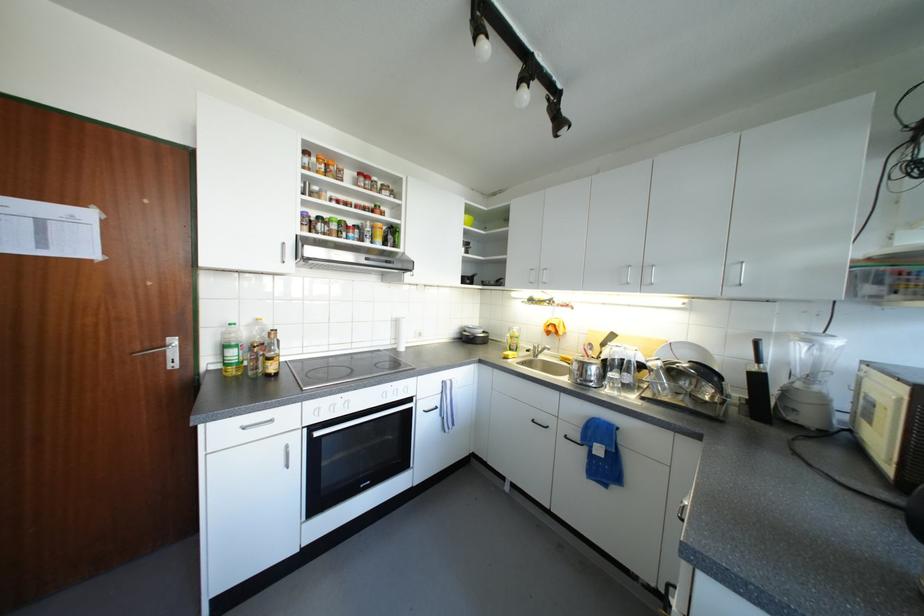
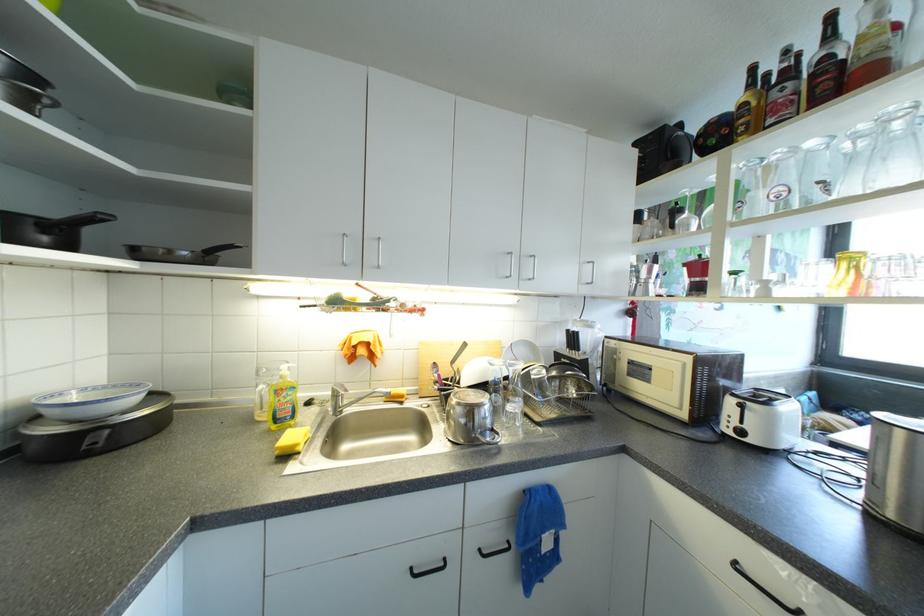
Find the pixel in the second image that matches [540,424] in the first image.

(417, 573)